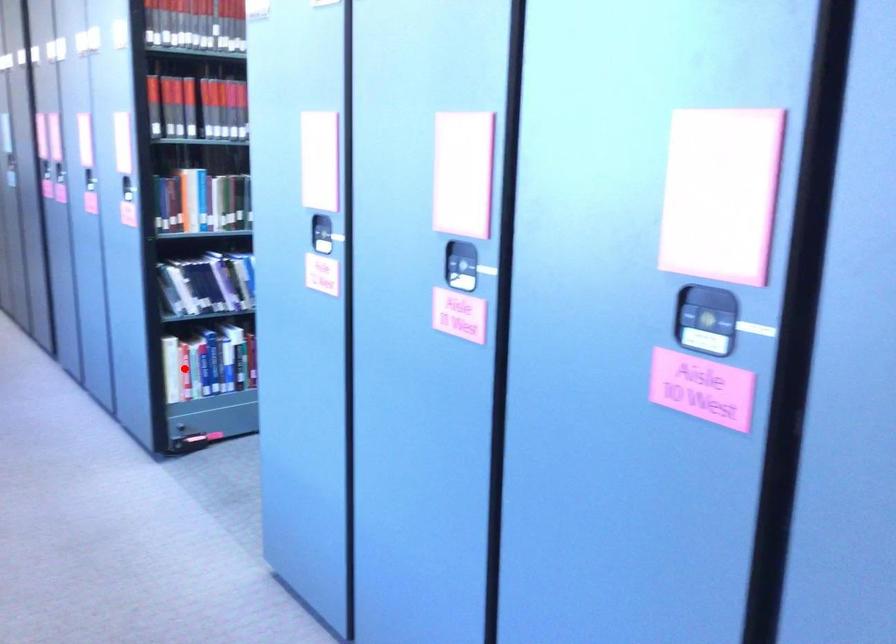
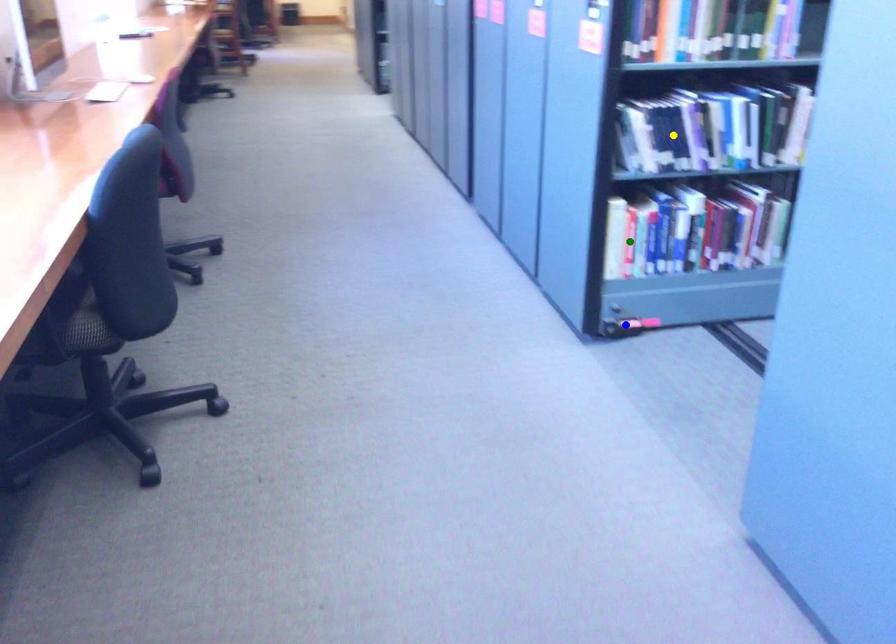
Question: I am providing you with two images of the same scene from different viewpoints. A red point is marked on the first image. You are given multiple points on the second image. Can you choose the point in image 2 that corresponds to the point in image 1?

Choices:
 (A) yellow point
 (B) green point
 (C) blue point

Answer: (B)